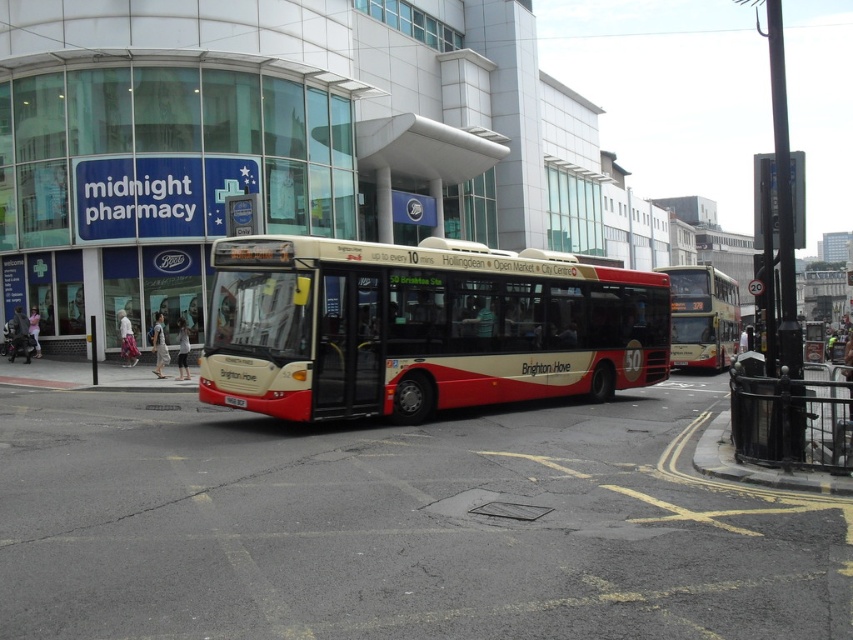
Question: Which of the following is the farthest from the observer?

Choices:
 (A) black metal curb at lower right
 (B) gold metallic bus at right

Answer: (B)

Question: Does red matte bus at center appear on the right side of gold metallic bus at right?

Choices:
 (A) no
 (B) yes

Answer: (A)

Question: Among these points, which one is nearest to the camera?

Choices:
 (A) (706, 442)
 (B) (389, 358)

Answer: (A)

Question: Can you confirm if red matte bus at center is wider than gold metallic bus at right?

Choices:
 (A) no
 (B) yes

Answer: (A)

Question: Which point is closer to the camera?

Choices:
 (A) pyautogui.click(x=694, y=465)
 (B) pyautogui.click(x=717, y=326)
 (C) pyautogui.click(x=383, y=368)

Answer: (A)

Question: Can you confirm if gold metallic bus at right is positioned above black metal curb at lower right?

Choices:
 (A) no
 (B) yes

Answer: (B)